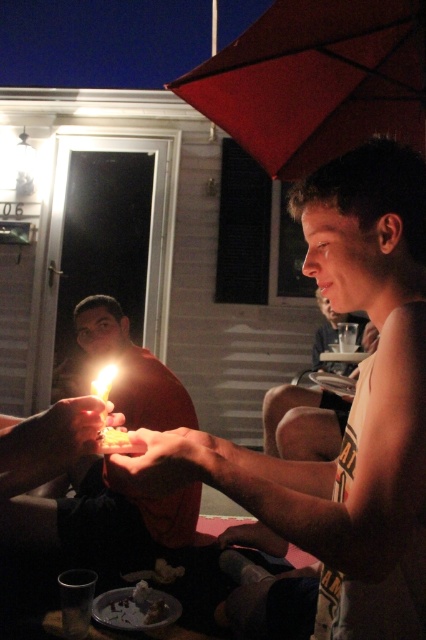
Between point (414, 28) and point (268, 428), which one is positioned in front?

Point (414, 28) is more forward.

Can you confirm if matte red umbrella at upper center is taller than smooth skin face at center?

No, matte red umbrella at upper center is not taller than smooth skin face at center.

Where is `matte red umbrella at upper center`? The width and height of the screenshot is (426, 640). matte red umbrella at upper center is located at coordinates (316, 81).

Who is shorter, matte black cake at center or matte red shirt at center?

matte red shirt at center

This screenshot has width=426, height=640. Find the location of `matte black cake at center`. matte black cake at center is located at coordinates (345, 424).

Which is behind, point (405, 499) or point (158, 419)?

Point (158, 419)

At what (x,y) coordinates should I click in order to perform the action: click on matte black cake at center. Please return your answer as a coordinate pair (x, y). Looking at the image, I should click on (345, 424).

Does point (331, 230) lie in front of point (100, 380)?

Yes, point (331, 230) is in front of point (100, 380).

Is point (345, 596) positioned before point (95, 387)?

Yes, point (345, 596) is in front of point (95, 387).

The height and width of the screenshot is (640, 426). In order to click on matte black cake at center in this screenshot , I will do `click(345, 424)`.